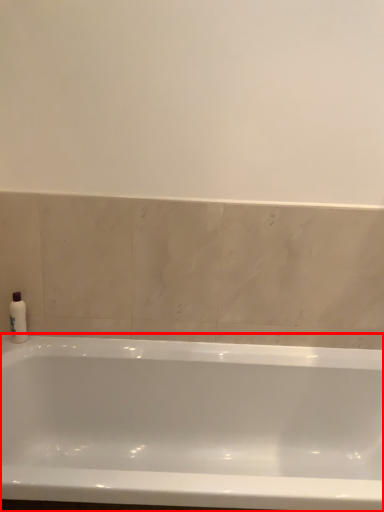
Question: From the image's perspective, considering the relative positions of bathtub (annotated by the red box) and soap dispenser in the image provided, where is bathtub (annotated by the red box) located with respect to the staircase?

Choices:
 (A) below
 (B) above

Answer: (A)